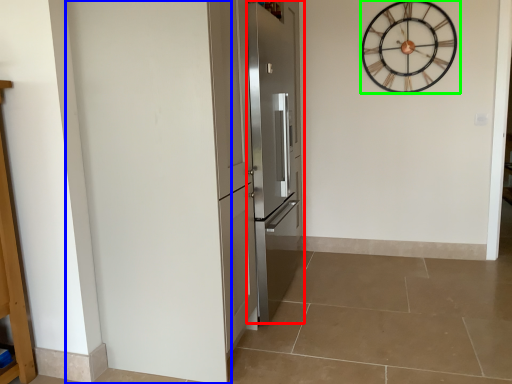
Question: Which object is the closest to the door (highlighted by a red box)? Choose among these: door (highlighted by a blue box) or wall clock (highlighted by a green box).

Choices:
 (A) door
 (B) wall clock

Answer: (A)